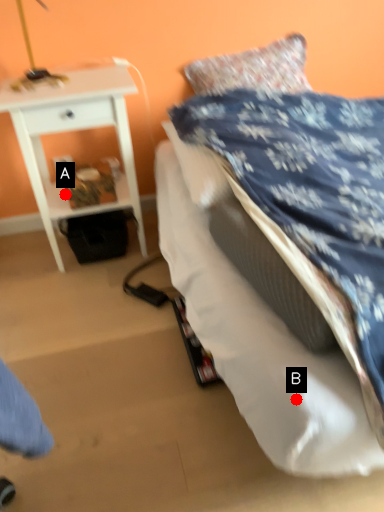
Question: Two points are circled on the image, labeled by A and B beside each circle. Which point appears farthest from the camera in this image?

Choices:
 (A) A is further
 (B) B is further

Answer: (A)